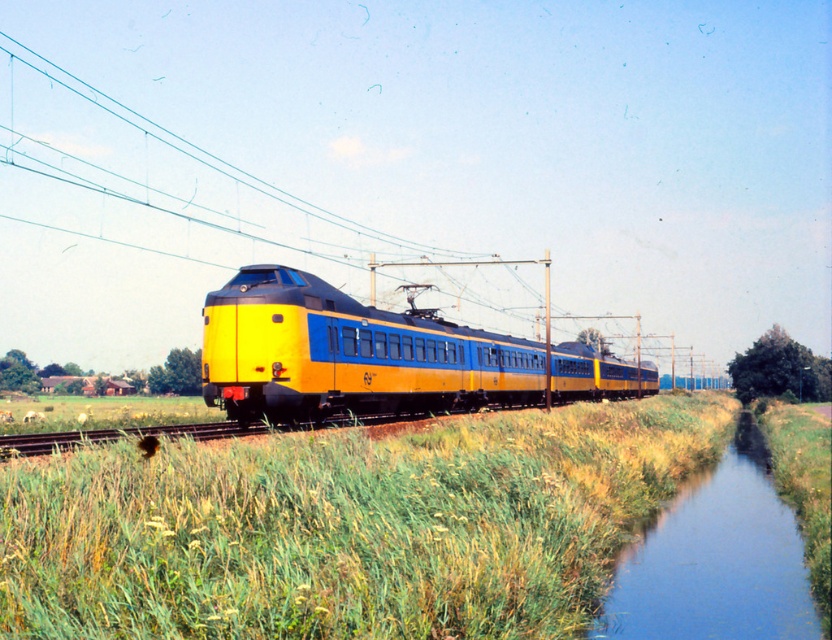
Question: Which object is positioned farthest from the blue smooth water at lower right?

Choices:
 (A) yellow matte train at center
 (B) green grassy at center

Answer: (A)

Question: Does green grassy at center have a larger size compared to yellow matte train at center?

Choices:
 (A) yes
 (B) no

Answer: (B)

Question: Which of the following is the closest to the observer?

Choices:
 (A) (394, 353)
 (B) (613, 595)

Answer: (B)

Question: Is green grassy at center above blue smooth water at lower right?

Choices:
 (A) yes
 (B) no

Answer: (A)

Question: Can you confirm if green grassy at center is positioned below yellow matte train at center?

Choices:
 (A) yes
 (B) no

Answer: (A)

Question: Among these objects, which one is nearest to the camera?

Choices:
 (A) blue smooth water at lower right
 (B) green grassy at center
 (C) yellow matte train at center

Answer: (B)